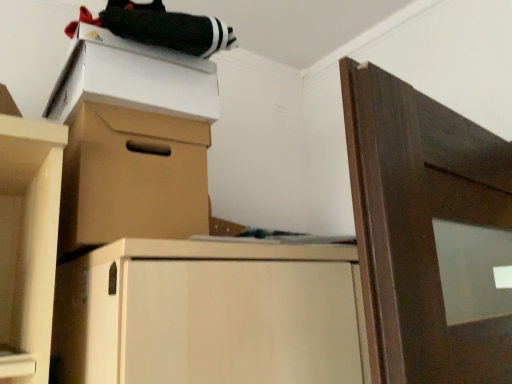
Question: Can you confirm if white cardboard box at upper left is smaller than brown cardboard box at upper center?

Choices:
 (A) yes
 (B) no

Answer: (A)

Question: From a real-world perspective, does white cardboard box at upper left sit lower than brown cardboard box at upper center?

Choices:
 (A) no
 (B) yes

Answer: (A)

Question: Is white cardboard box at upper left thinner than brown cardboard box at upper center?

Choices:
 (A) no
 (B) yes

Answer: (A)

Question: Is the depth of white cardboard box at upper left greater than that of brown cardboard box at upper center?

Choices:
 (A) yes
 (B) no

Answer: (A)

Question: Is white cardboard box at upper left oriented towards brown cardboard box at upper center?

Choices:
 (A) yes
 (B) no

Answer: (B)

Question: From the image's perspective, is white cardboard box at upper left on top of brown cardboard box at upper center?

Choices:
 (A) no
 (B) yes

Answer: (B)

Question: Is brown cardboard box at upper center not close to white cardboard box at upper left?

Choices:
 (A) yes
 (B) no

Answer: (B)

Question: Does brown cardboard box at upper center have a smaller size compared to white cardboard box at upper left?

Choices:
 (A) no
 (B) yes

Answer: (A)

Question: From a real-world perspective, is brown cardboard box at upper center beneath white cardboard box at upper left?

Choices:
 (A) no
 (B) yes

Answer: (B)

Question: From the image's perspective, would you say brown cardboard box at upper center is positioned over white cardboard box at upper left?

Choices:
 (A) no
 (B) yes

Answer: (A)

Question: Is brown cardboard box at upper center positioned with its back to white cardboard box at upper left?

Choices:
 (A) no
 (B) yes

Answer: (A)

Question: Can you confirm if brown cardboard box at upper center is shorter than white cardboard box at upper left?

Choices:
 (A) yes
 (B) no

Answer: (B)

Question: In terms of height, does brown cardboard box at upper center look taller or shorter compared to white cardboard box at upper left?

Choices:
 (A) tall
 (B) short

Answer: (A)